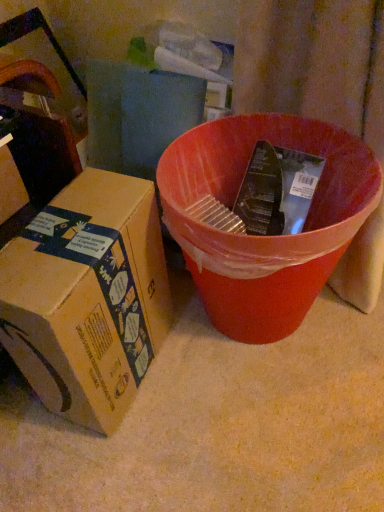
Question: Does brown cardboard box at left, positioned as the first box in left-to-right order, have a lesser height compared to matte plastic bucket at center?

Choices:
 (A) yes
 (B) no

Answer: (A)

Question: From the image's perspective, does brown cardboard box at left, positioned as the first box in left-to-right order, appear higher than matte plastic bucket at center?

Choices:
 (A) no
 (B) yes

Answer: (B)

Question: Is brown cardboard box at left, positioned as the first box in left-to-right order, taller than matte plastic bucket at center?

Choices:
 (A) no
 (B) yes

Answer: (A)

Question: Is matte plastic bucket at center a part of brown cardboard box at left, positioned as the first box in left-to-right order?

Choices:
 (A) no
 (B) yes

Answer: (A)

Question: Is brown cardboard box at left, arranged as the 2th box when viewed from the right, at the right side of matte plastic bucket at center?

Choices:
 (A) no
 (B) yes

Answer: (A)

Question: Considering the relative sizes of brown cardboard box at left, positioned as the first box in left-to-right order, and matte plastic bucket at center in the image provided, is brown cardboard box at left, positioned as the first box in left-to-right order, wider than matte plastic bucket at center?

Choices:
 (A) no
 (B) yes

Answer: (A)

Question: Does matte plastic bucket at center have a larger size compared to brown cardboard box at left, positioned as the first box in left-to-right order?

Choices:
 (A) yes
 (B) no

Answer: (A)

Question: Considering the relative sizes of matte plastic bucket at center and brown cardboard box at left, positioned as the first box in left-to-right order, in the image provided, is matte plastic bucket at center thinner than brown cardboard box at left, positioned as the first box in left-to-right order,?

Choices:
 (A) no
 (B) yes

Answer: (A)

Question: Does matte plastic bucket at center appear on the left side of brown cardboard box at left, positioned as the first box in left-to-right order?

Choices:
 (A) yes
 (B) no

Answer: (B)

Question: Could you tell me if matte plastic bucket at center is turned towards brown cardboard box at left, arranged as the 2th box when viewed from the right?

Choices:
 (A) yes
 (B) no

Answer: (B)

Question: Is matte plastic bucket at center next to brown cardboard box at left, arranged as the 2th box when viewed from the right, and touching it?

Choices:
 (A) yes
 (B) no

Answer: (B)

Question: Is matte plastic bucket at center outside brown cardboard box at left, positioned as the first box in left-to-right order?

Choices:
 (A) yes
 (B) no

Answer: (A)

Question: Is brown cardboard box at left, which is the 1th box from right to left, outside brown cardboard box at left, arranged as the 2th box when viewed from the right?

Choices:
 (A) no
 (B) yes

Answer: (B)